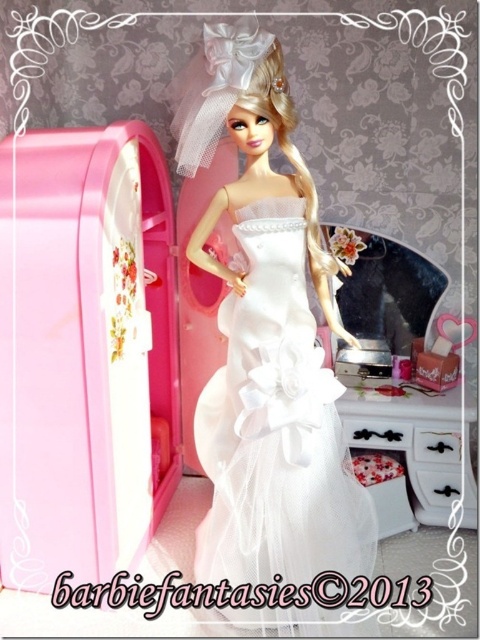
You are a guest at a miniature wedding display and want to place a small bouquet between the matte white dress at center and the white wood dresser at lower right. Based on their positions, where should you place it?

The matte white dress at center is above the white wood dresser at lower right, so you should place the bouquet between them either on the dresser or slightly below the dress to maintain balance.

You are standing in a room and see the matte white dress at center. If you want to touch the dress, how many steps do you need to take if each step covers 1.1 feet?

The distance between you and the matte white dress at center is 3.30 feet. Since each step covers 1.1 feet, you would need to take 3 steps to reach the dress.